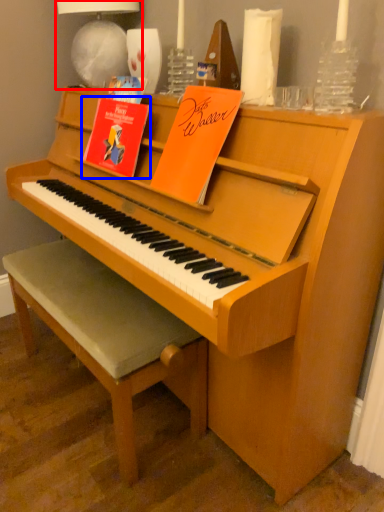
Question: Which of the following is the farthest to the observer, lamp (highlighted by a red box) or paperback book (highlighted by a blue box)?

Choices:
 (A) lamp
 (B) paperback book

Answer: (A)